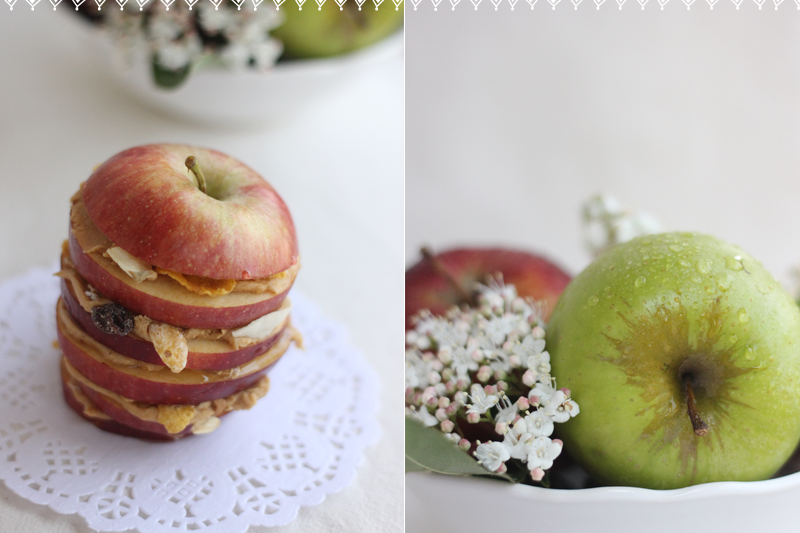
At what (x,y) coordinates should I click in order to perform the action: click on table. Please return your answer as a coordinate pair (x, y). This screenshot has height=533, width=800. Looking at the image, I should click on (30, 152), (354, 237).